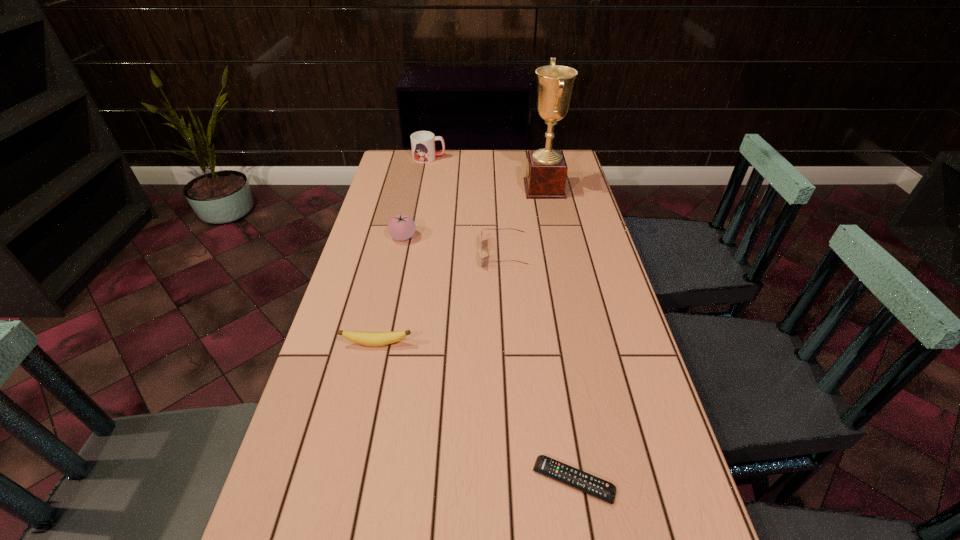
Where is `vacant space located on the plaque of the tallest object`? vacant space located on the plaque of the tallest object is located at coordinates (435, 188).

This screenshot has width=960, height=540. Identify the location of vacant region located on the plaque of the tallest object. (440, 188).

Locate an element on the screen. free region located on the side of the fifth shortest object with the handle is located at coordinates (463, 158).

The width and height of the screenshot is (960, 540). Find the location of `vacant space located on the left of the fourth shortest object`. vacant space located on the left of the fourth shortest object is located at coordinates (371, 237).

Identify the location of free space located 0.390m on the right of the second nearest object. (x=568, y=344).

Identify the location of vacant position located 0.070m on the front-facing side of the sunglasses. (459, 254).

Locate an element on the screen. The width and height of the screenshot is (960, 540). free spot located 0.380m on the front-facing side of the sunglasses is located at coordinates click(359, 254).

Where is `vacant region located 0.110m on the front-facing side of the sunglasses`? vacant region located 0.110m on the front-facing side of the sunglasses is located at coordinates (445, 254).

Image resolution: width=960 pixels, height=540 pixels. What are the coordinates of `vacant point located on the back of the remote control` in the screenshot? It's located at (559, 386).

I want to click on trophy cup at the far edge, so click(546, 173).